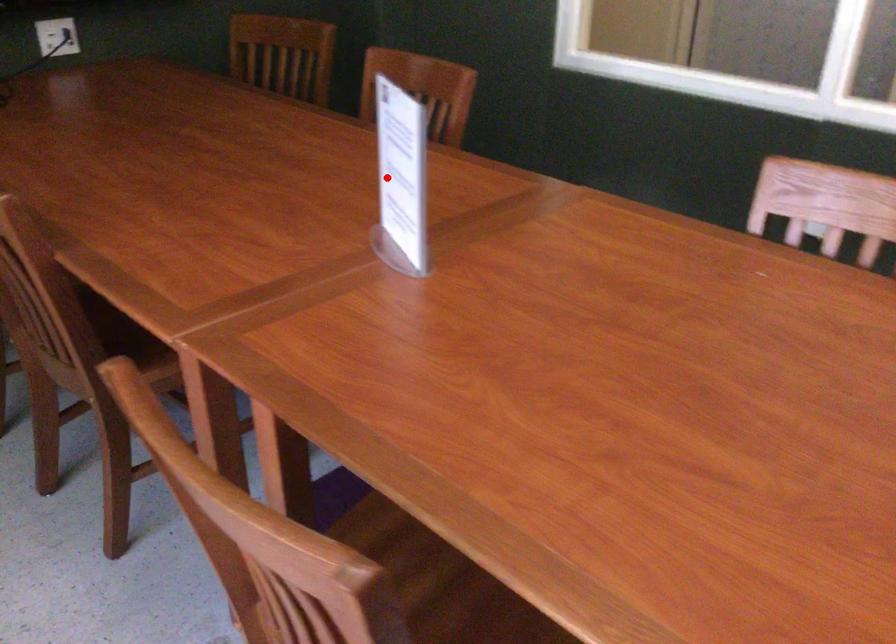
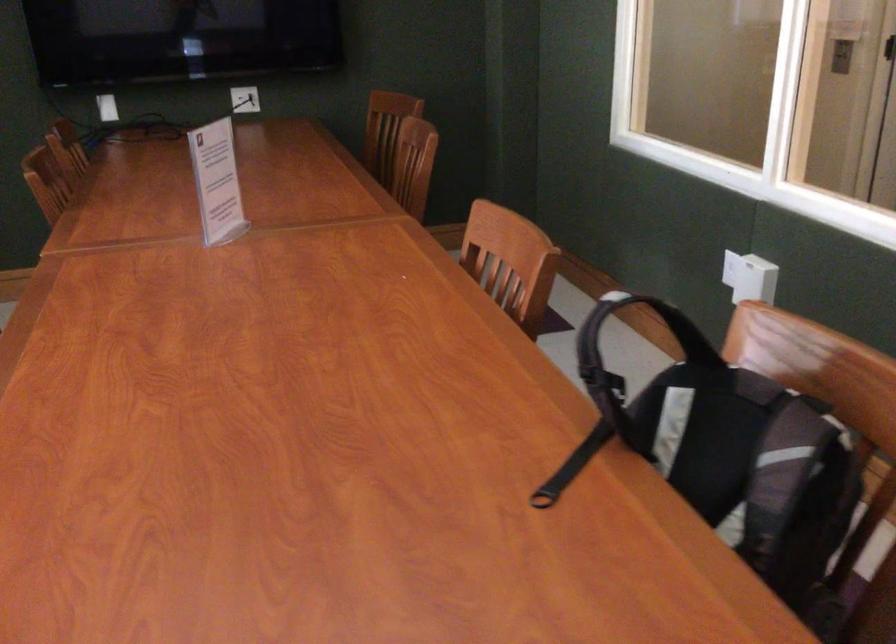
Question: I am providing you with two images of the same scene from different viewpoints. In image1, a red point is highlighted. Considering the same 3D point in image2, which of the following is correct?

Choices:
 (A) It is closer
 (B) It is farther

Answer: (B)